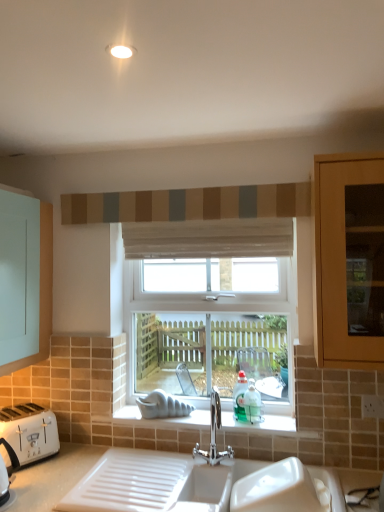
Question: Is textured fabric curtain at upper center, which is the second curtain from bottom to top, in front of or behind polished chrome tap at center in the image?

Choices:
 (A) behind
 (B) front

Answer: (A)

Question: Would you say textured fabric curtain at upper center, which is the second curtain from bottom to top, is inside or outside polished chrome tap at center?

Choices:
 (A) inside
 (B) outside

Answer: (B)

Question: Which object is positioned closest to the white plastic toaster at lower left?

Choices:
 (A) textured fabric curtain at upper center, which is counted as the 1th curtain, starting from the top
 (B) clear glass window at center
 (C) polished chrome tap at center
 (D) teal glass bottle at window
 (E) white sheer curtain at center, which is counted as the 2th curtain, starting from the top

Answer: (C)

Question: Estimate the real-world distances between objects in this image. Which object is closer to the teal glass bottle at window?

Choices:
 (A) textured fabric curtain at upper center, which is counted as the 1th curtain, starting from the top
 (B) polished chrome tap at center
 (C) white plastic toaster at lower left
 (D) clear glass window at center
 (E) white sheer curtain at center, which is counted as the 1th curtain, starting from the bottom

Answer: (B)